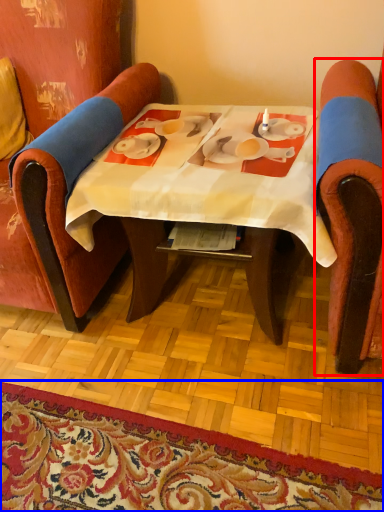
Question: Which object is closer to the camera taking this photo, chair (highlighted by a red box) or mat (highlighted by a blue box)?

Choices:
 (A) chair
 (B) mat

Answer: (A)